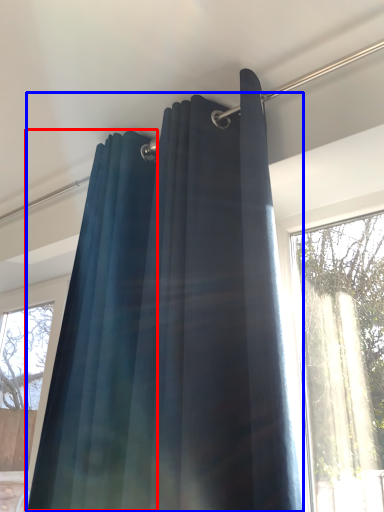
Question: Which point is further to the camera, shower curtain (highlighted by a red box) or curtain (highlighted by a blue box)?

Choices:
 (A) shower curtain
 (B) curtain

Answer: (A)